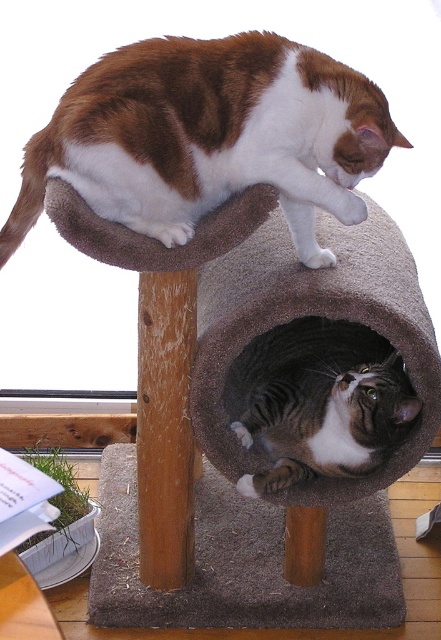
Question: Can you confirm if gray carpeted cat bed at center is positioned to the right of gray striped cat at lower center?

Choices:
 (A) yes
 (B) no

Answer: (A)

Question: Which point appears closest to the camera in this image?

Choices:
 (A) (396, 282)
 (B) (224, 163)

Answer: (B)

Question: Can you confirm if brown and white fur cat at upper center is thinner than gray carpeted cat bed at center?

Choices:
 (A) yes
 (B) no

Answer: (B)

Question: In this image, where is brown and white fur cat at upper center located relative to gray carpeted cat bed at center?

Choices:
 (A) left
 (B) right

Answer: (A)

Question: Which object is farther from the camera taking this photo?

Choices:
 (A) fuzzy gray cat bed at upper center
 (B) gray striped cat at lower center
 (C) brown and white fur cat at upper center
 (D) gray carpeted cat bed at center

Answer: (B)

Question: Which of the following is the farthest from the observer?

Choices:
 (A) (336, 458)
 (B) (168, 51)
 (C) (287, 272)

Answer: (C)